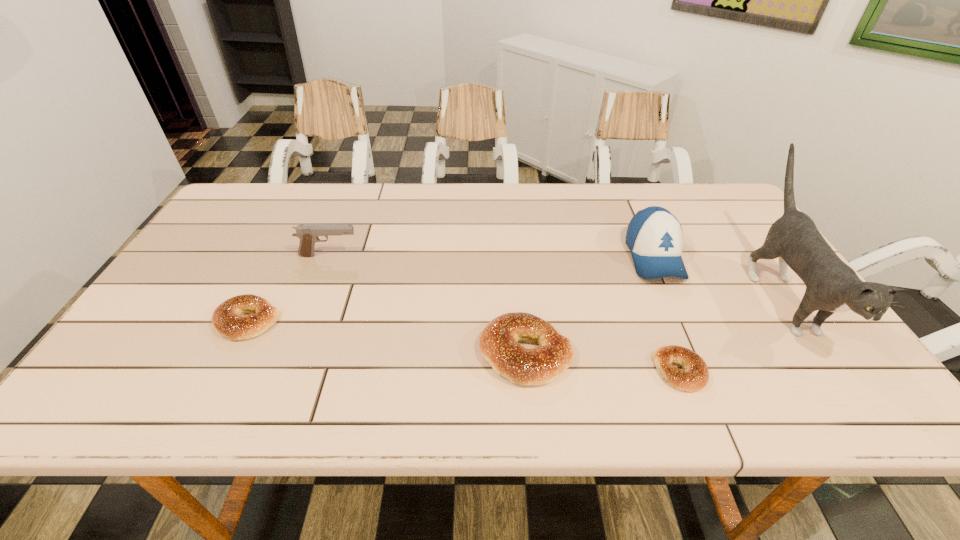
To make them evenly spaced by inserting another bagel among them, please locate a free space for this new bagel. Please provide its 2D coordinates. Your answer should be formatted as a tuple, i.e. [(x, y)], where the tuple contains the x and y coordinates of a point satisfying the conditions above.

[(382, 336)]